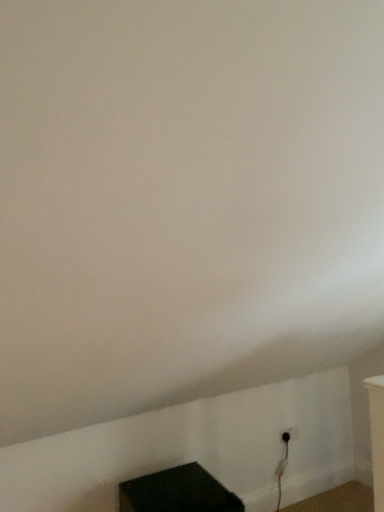
Question: From their relative heights in the image, would you say black plastic outlet at lower right is taller or shorter than black matte cube at lower center?

Choices:
 (A) tall
 (B) short

Answer: (B)

Question: Based on their positions, is black plastic outlet at lower right located to the left or right of black matte cube at lower center?

Choices:
 (A) left
 (B) right

Answer: (B)

Question: In terms of width, does black plastic outlet at lower right look wider or thinner when compared to black matte cube at lower center?

Choices:
 (A) thin
 (B) wide

Answer: (A)

Question: Is black matte cube at lower center spatially inside black plastic outlet at lower right, or outside of it?

Choices:
 (A) outside
 (B) inside

Answer: (A)

Question: Is black matte cube at lower center taller or shorter than black plastic outlet at lower right?

Choices:
 (A) short
 (B) tall

Answer: (B)

Question: Is black matte cube at lower center to the left or to the right of black plastic outlet at lower right in the image?

Choices:
 (A) right
 (B) left

Answer: (B)

Question: Is point (127, 488) closer or farther from the camera than point (291, 436)?

Choices:
 (A) closer
 (B) farther

Answer: (A)